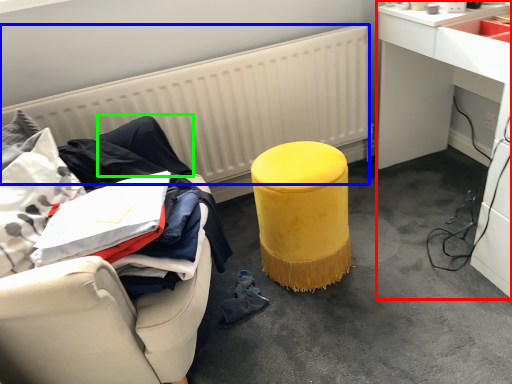
Question: Based on their relative distances, which object is nearer to desk (highlighted by a red box)? Choose from radiator (highlighted by a blue box) and clothing (highlighted by a green box).

Choices:
 (A) radiator
 (B) clothing

Answer: (A)